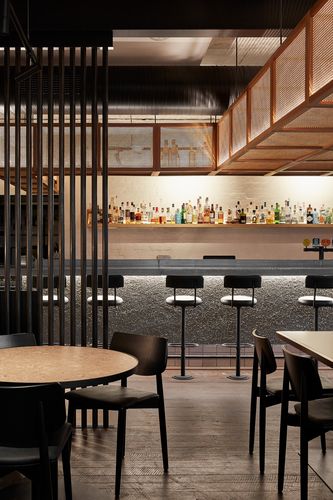
Find the location of `black stool`. black stool is located at coordinates (319, 297), (240, 299), (184, 300), (112, 299), (55, 298).